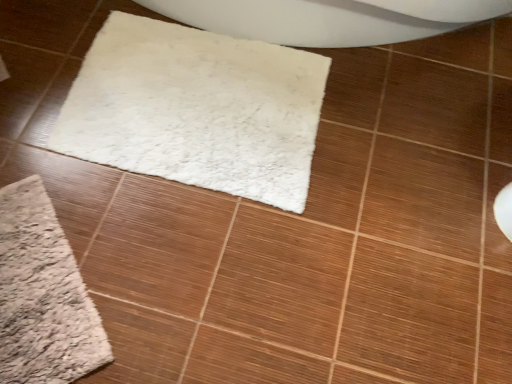
You are a GUI agent. You are given a task and a screenshot of the screen. Output one action in this format:
    pyautogui.click(x=<x>, y=<y>)
    Task: Click on the vacant area to the right of white fluffy mat at center
    
    Given the screenshot: What is the action you would take?
    pyautogui.click(x=401, y=151)